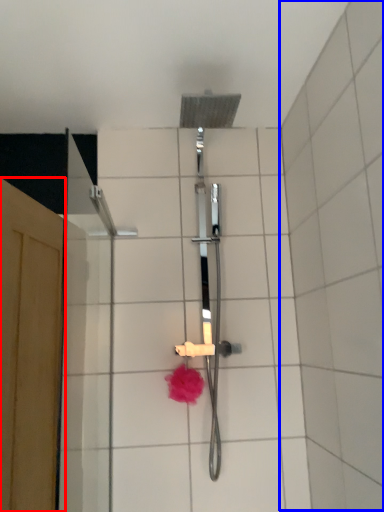
Question: Which object appears closest to the camera in this image, screen door (highlighted by a red box) or ceramic tile (highlighted by a blue box)?

Choices:
 (A) screen door
 (B) ceramic tile

Answer: (B)